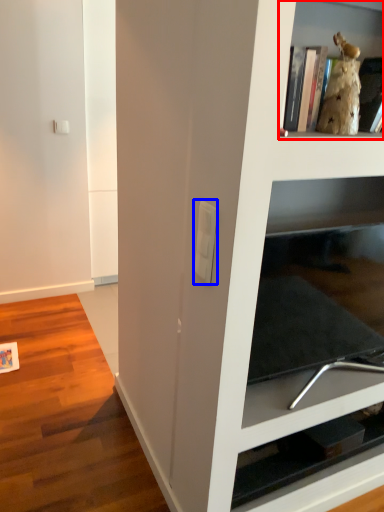
Question: Among these objects, which one is nearest to the camera, shelf (highlighted by a red box) or light switch (highlighted by a blue box)?

Choices:
 (A) shelf
 (B) light switch

Answer: (A)